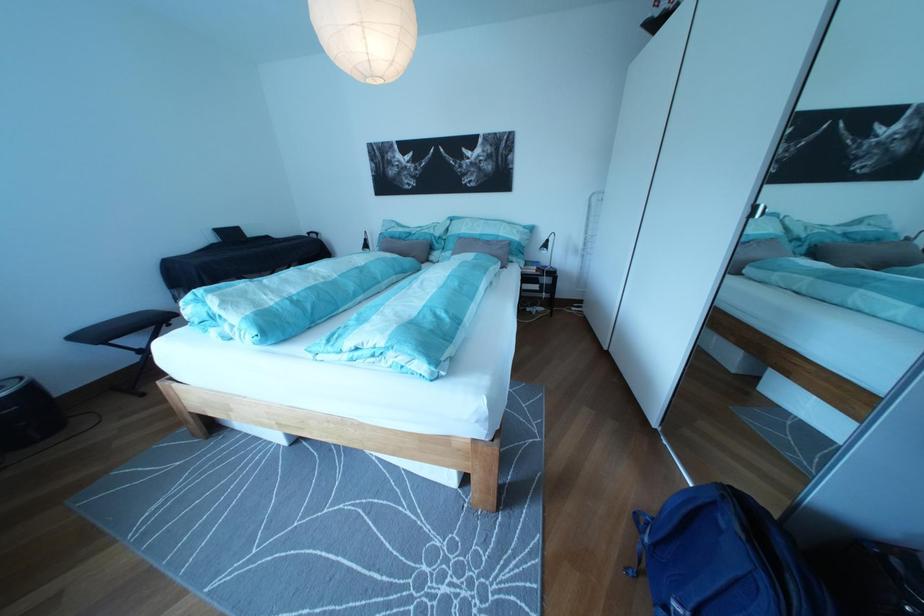
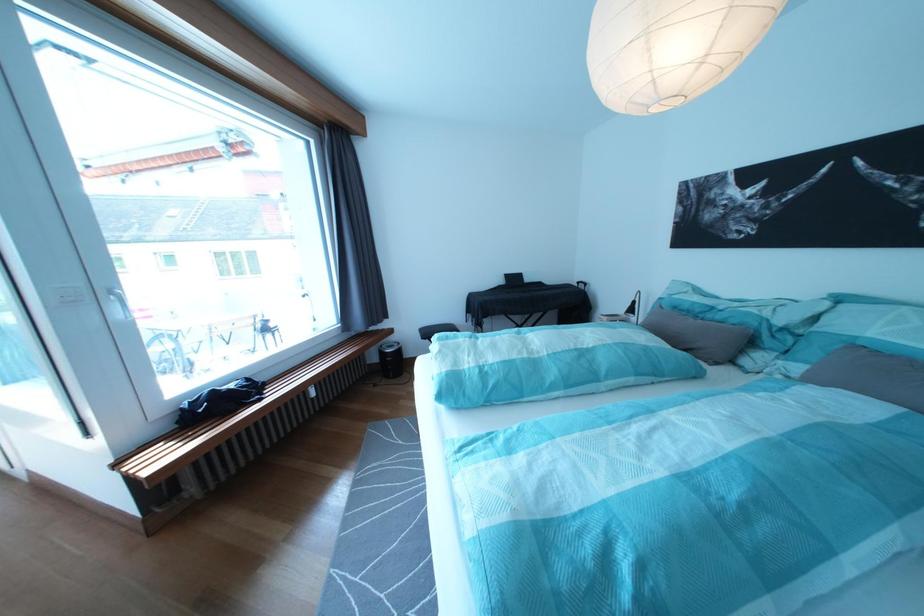
Locate, in the second image, the point that corresponds to point (463, 227) in the first image.

(841, 309)